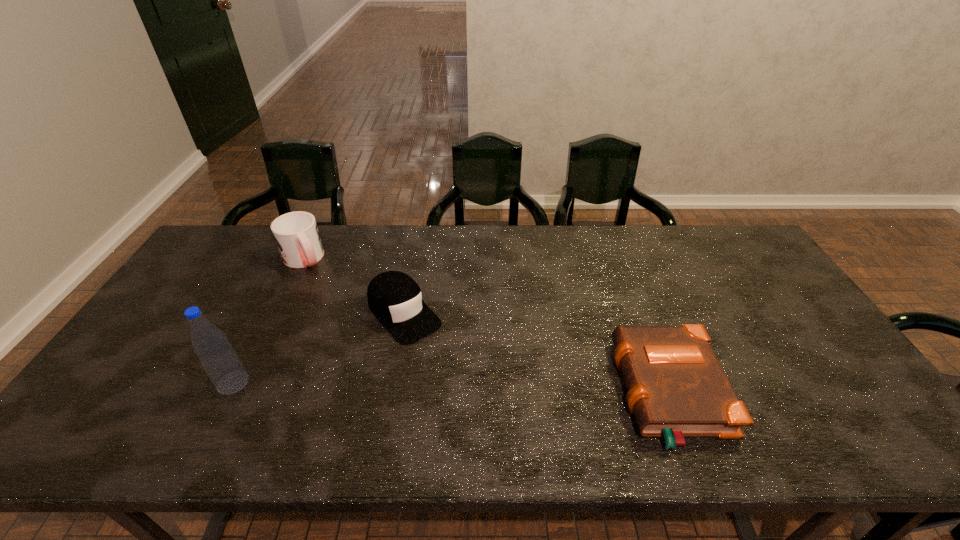
Image resolution: width=960 pixels, height=540 pixels. I want to click on vacant space at the far edge of the desktop, so click(346, 260).

In the image, there is a desktop. At what (x,y) coordinates should I click in order to perform the action: click on blank space at the near edge. Please return your answer as a coordinate pair (x, y). Image resolution: width=960 pixels, height=540 pixels. Looking at the image, I should click on click(x=162, y=410).

This screenshot has height=540, width=960. In the image, there is a desktop. What are the coordinates of `vacant space at the left edge` in the screenshot? It's located at (239, 272).

Identify the location of vacant space at the right edge of the desktop. (786, 339).

The width and height of the screenshot is (960, 540). In the image, there is a desktop. In order to click on vacant space at the far left corner in this screenshot , I will do `click(259, 228)`.

Where is `vacant space in between the Bible and the second tallest object`? The width and height of the screenshot is (960, 540). vacant space in between the Bible and the second tallest object is located at coordinates (487, 326).

Identify the location of free point between the third shortest object and the second object from right to left. (354, 286).

This screenshot has height=540, width=960. What are the coordinates of `vacant area that lies between the third object from left to right and the shortest object` in the screenshot? It's located at point(537,354).

The image size is (960, 540). Identify the location of free space that is in between the third tallest object and the Bible. (537, 354).

Where is `free space between the farthest object and the Bible`? This screenshot has width=960, height=540. free space between the farthest object and the Bible is located at coordinates (487, 326).